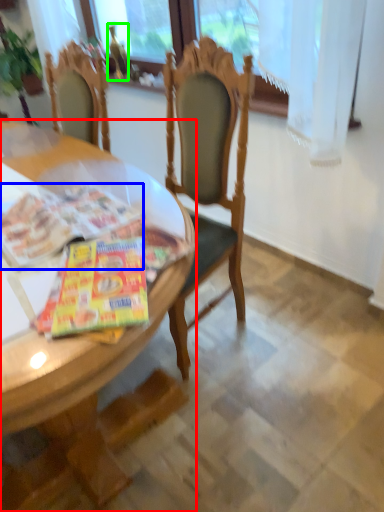
Question: Which is farther away from desk (highlighted by a red box)? magazine (highlighted by a blue box) or bottle (highlighted by a green box)?

Choices:
 (A) magazine
 (B) bottle

Answer: (B)